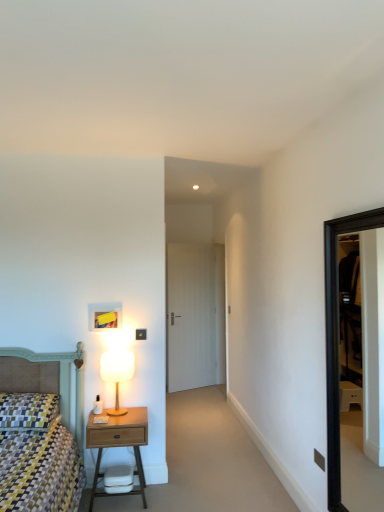
Locate an element on the screen. This screenshot has height=512, width=384. vacant region below matte white lamp at left (from a real-world perspective) is located at coordinates coord(125,407).